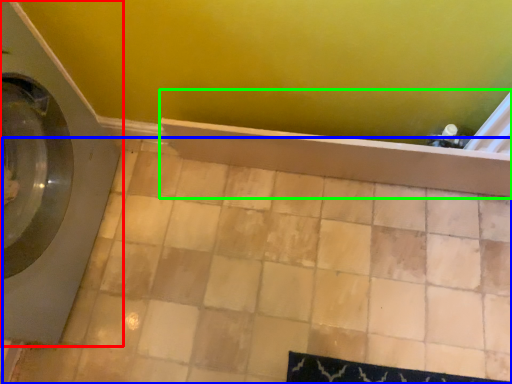
Question: Estimate the real-world distances between objects in this image. Which object is closer to washing machine (highlighted by a red box), ceramic tile (highlighted by a blue box) or bath (highlighted by a green box)?

Choices:
 (A) ceramic tile
 (B) bath

Answer: (A)